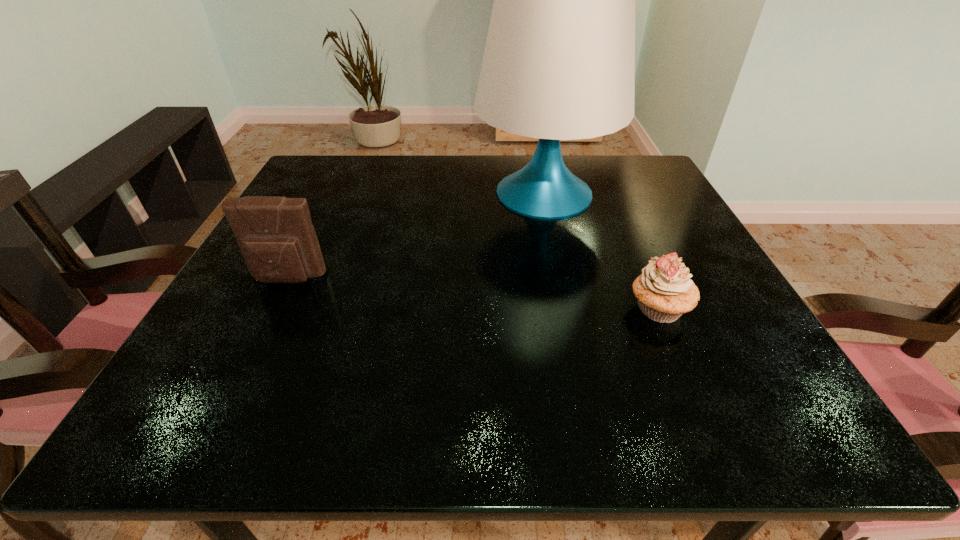
The height and width of the screenshot is (540, 960). I want to click on table lamp, so click(559, 62).

Find the location of a particular element. The height and width of the screenshot is (540, 960). the farthest object is located at coordinates (559, 62).

Identify the location of the second nearest object. This screenshot has height=540, width=960. (x=276, y=236).

The image size is (960, 540). Identify the location of pouch. (276, 236).

Identify the location of cupcake. (664, 291).

Find the location of `the shortest object`. the shortest object is located at coordinates (664, 291).

In order to click on vacant area located 0.150m on the front-facing side of the tallest object in this screenshot , I will do `click(411, 194)`.

Identify the location of free space located on the front-facing side of the tallest object. The image size is (960, 540). (436, 194).

At what (x,y) coordinates should I click in order to perform the action: click on free space located on the front-facing side of the tallest object. Please return your answer as a coordinate pair (x, y). This screenshot has width=960, height=540. Looking at the image, I should click on (330, 194).

At what (x,y) coordinates should I click in order to perform the action: click on free space located with an open flap on the second tallest object. Please return your answer as a coordinate pair (x, y). Looking at the image, I should click on (260, 336).